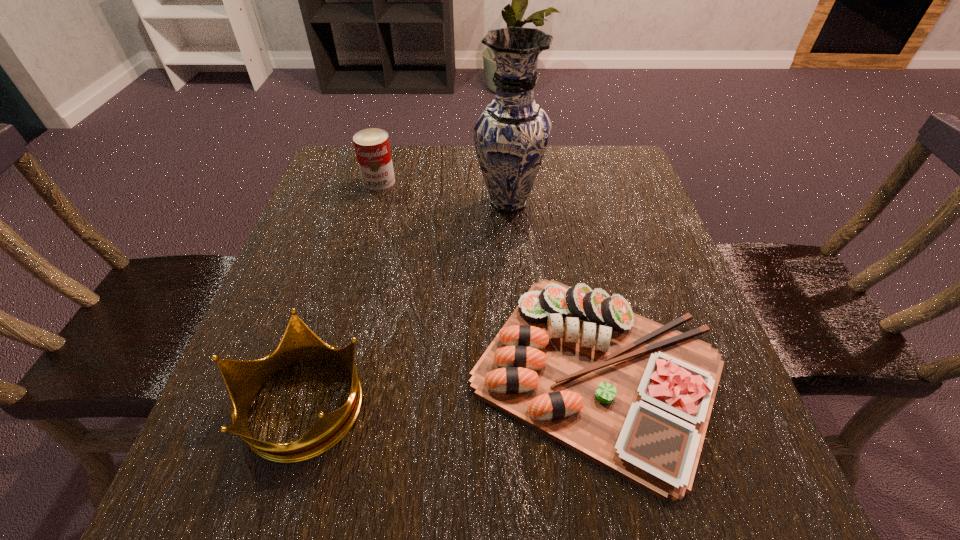
Where is `crown at the near edge`? crown at the near edge is located at coordinates (244, 378).

Identify the location of platter that is positioned at the near edge. The height and width of the screenshot is (540, 960). (580, 366).

I want to click on can at the left edge, so click(x=372, y=147).

Where is `crown located in the left edge section of the desktop`? crown located in the left edge section of the desktop is located at coordinates (244, 378).

Where is `object at the right edge`? This screenshot has height=540, width=960. object at the right edge is located at coordinates (580, 366).

At what (x,y) coordinates should I click in order to perform the action: click on object present at the far left corner. Please return your answer as a coordinate pair (x, y). The height and width of the screenshot is (540, 960). Looking at the image, I should click on (372, 147).

At what (x,y) coordinates should I click in order to perform the action: click on object present at the near left corner. Please return your answer as a coordinate pair (x, y). Looking at the image, I should click on (244, 378).

Image resolution: width=960 pixels, height=540 pixels. Identify the location of object that is at the near right corner. (580, 366).

I want to click on vacant space at the far edge of the desktop, so click(x=565, y=170).

This screenshot has width=960, height=540. What are the coordinates of `vacant region at the near edge of the desktop` in the screenshot? It's located at (393, 464).